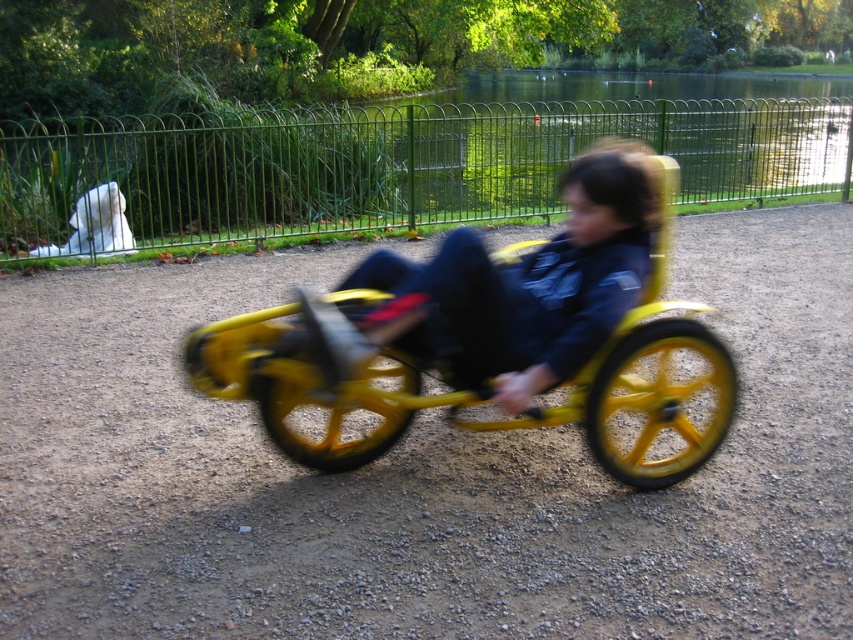
Question: Among these objects, which one is farthest from the camera?

Choices:
 (A) green metallic fence at upper center
 (B) white fur ghost at upper left
 (C) yellow matte tricycle at center

Answer: (A)

Question: Can you confirm if green metallic fence at upper center is smaller than white fur ghost at upper left?

Choices:
 (A) no
 (B) yes

Answer: (A)

Question: Can you confirm if yellow matte tricycle at center is bigger than white fur ghost at upper left?

Choices:
 (A) no
 (B) yes

Answer: (A)

Question: Which object is closer to the camera taking this photo?

Choices:
 (A) white fur ghost at upper left
 (B) green metallic fence at upper center
 (C) yellow matte tricycle at center

Answer: (C)

Question: Which point is closer to the camera?

Choices:
 (A) (91, 243)
 (B) (514, 308)
 (C) (688, 83)

Answer: (B)

Question: Is green metallic fence at upper center behind white fur ghost at upper left?

Choices:
 (A) no
 (B) yes

Answer: (B)